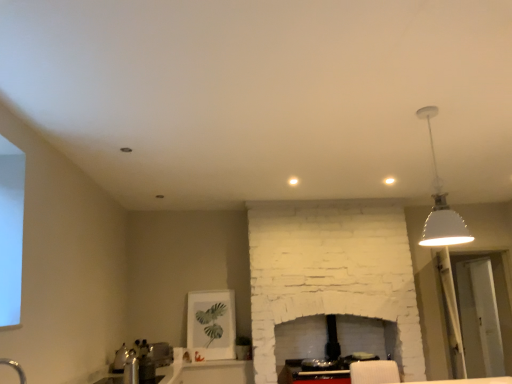
Question: From their relative heights in the image, would you say white matte lampshade at upper right is taller or shorter than transparent glass door at right?

Choices:
 (A) short
 (B) tall

Answer: (A)

Question: Is point (449, 243) closer or farther from the camera than point (489, 296)?

Choices:
 (A) closer
 (B) farther

Answer: (A)

Question: Which of these objects is positioned farthest from the silver metallic faucet at lower left?

Choices:
 (A) white matte lampshade at upper right
 (B) satin silver toaster at lower left
 (C) transparent glass door at right

Answer: (C)

Question: Which object is the farthest from the silver metallic faucet at lower left?

Choices:
 (A) satin silver toaster at lower left
 (B) transparent glass door at right
 (C) white matte lampshade at upper right

Answer: (B)